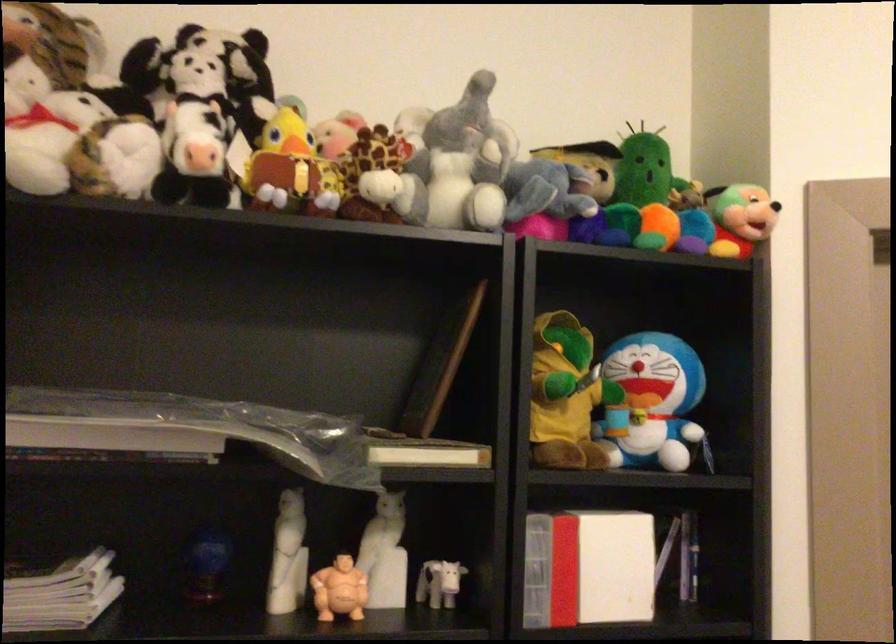
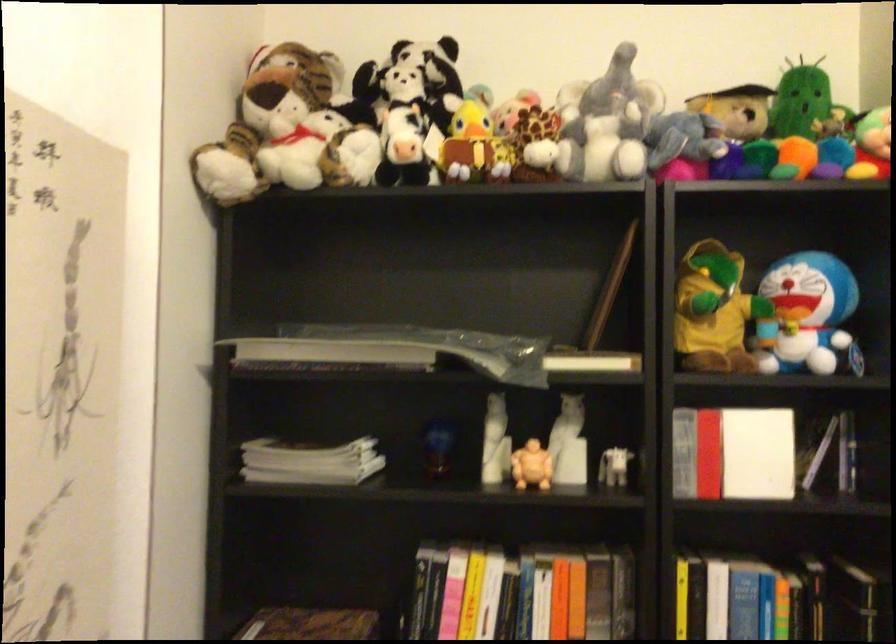
The point at (291, 554) is marked in the first image. Where is the corresponding point in the second image?

(495, 442)